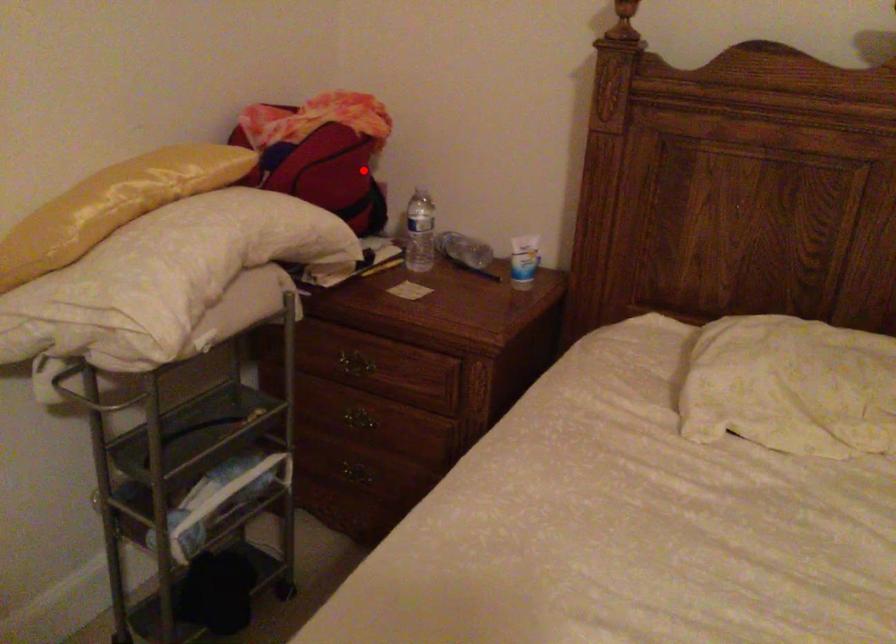
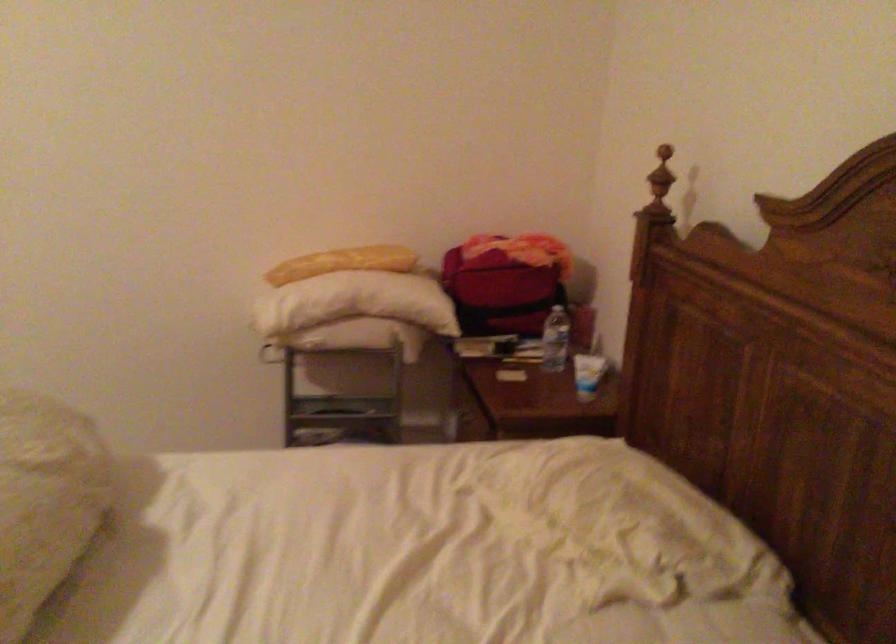
Find the pixel in the second image that matches the highlighted location in the first image.

(504, 281)